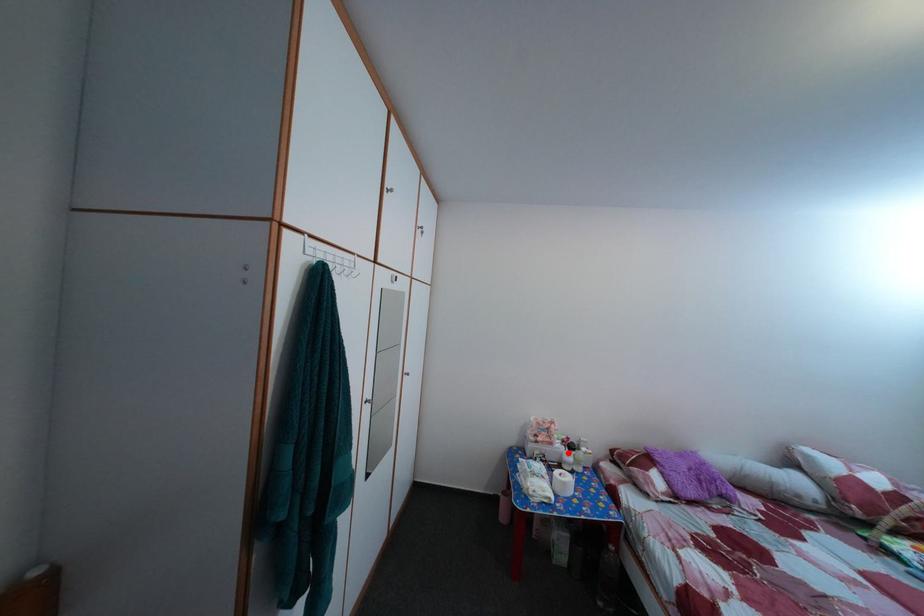
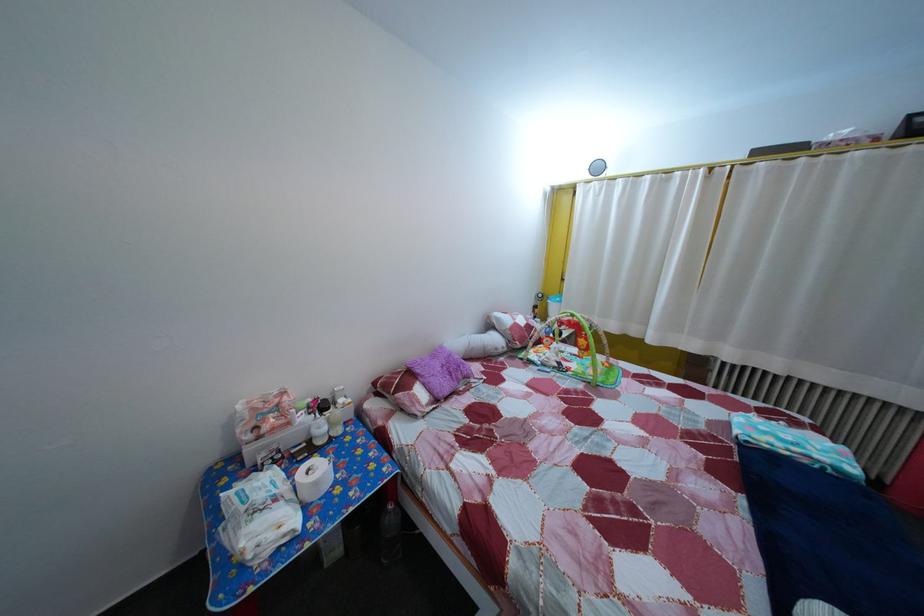
Question: A red point is marked in image1. In image2, is the corresponding 3D point closer to the camera or farther? Reply with the corresponding letter.

Choices:
 (A) The corresponding 3D point is closer.
 (B) The corresponding 3D point is farther.

Answer: (A)